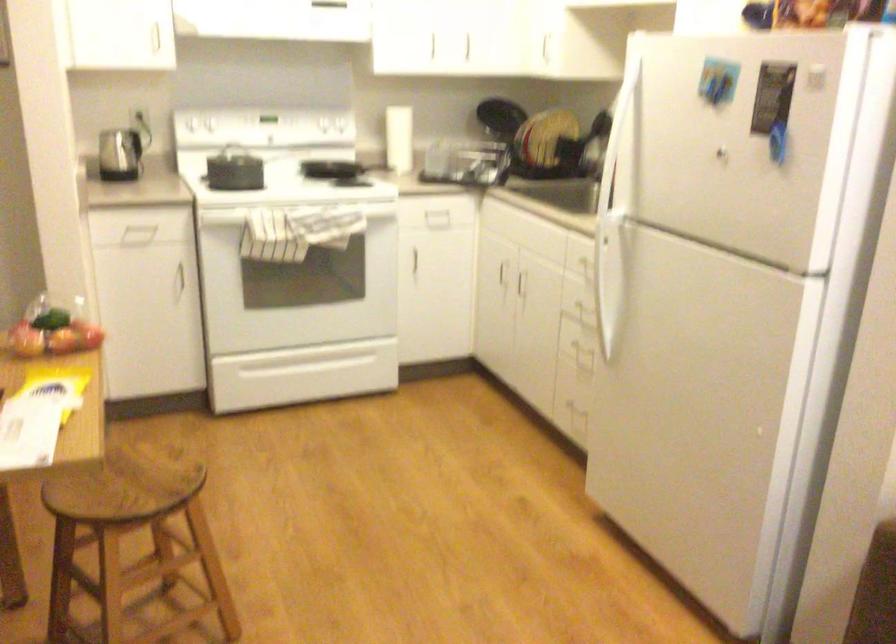
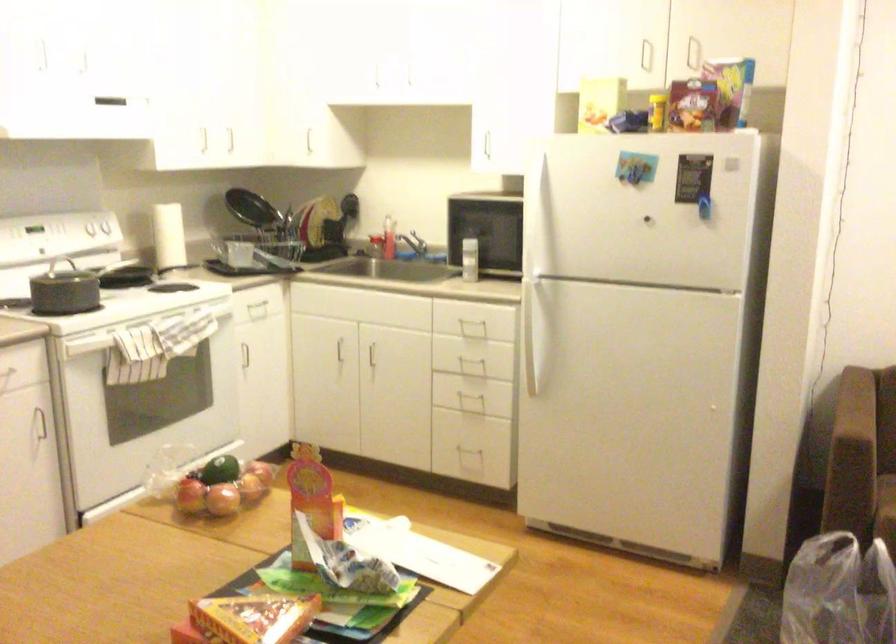
Question: I am providing you with two images of the same scene from different viewpoints. Please identify which objects are invisible in image2.

Choices:
 (A) refrigerator handle
 (B) white oven door handle
 (C) white stove knob
 (D) blue wall switch

Answer: (B)